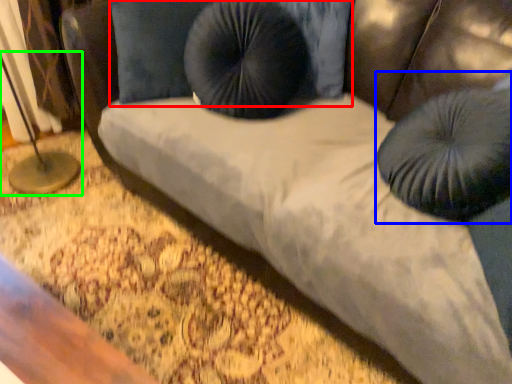
Question: Estimate the real-world distances between objects in this image. Which object is closer to pillow (highlighted by a red box), bean bag chair (highlighted by a blue box) or table lamp (highlighted by a green box)?

Choices:
 (A) bean bag chair
 (B) table lamp

Answer: (B)